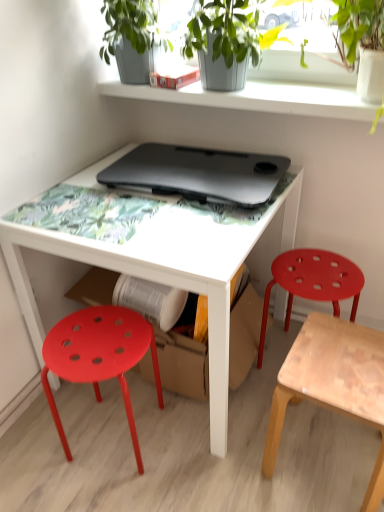
Locate an element on the screen. The image size is (384, 512). free space between light brown wooden stool at lower right, marked as the 2th stool in a left-to-right arrangement, and matte plastic stool at lower left, the 1th stool from the left is located at coordinates (206, 455).